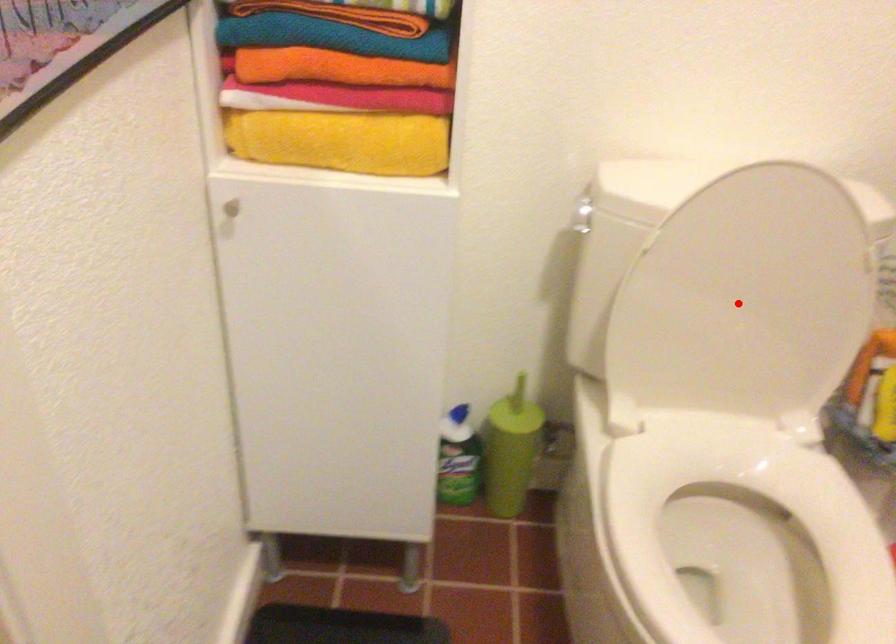
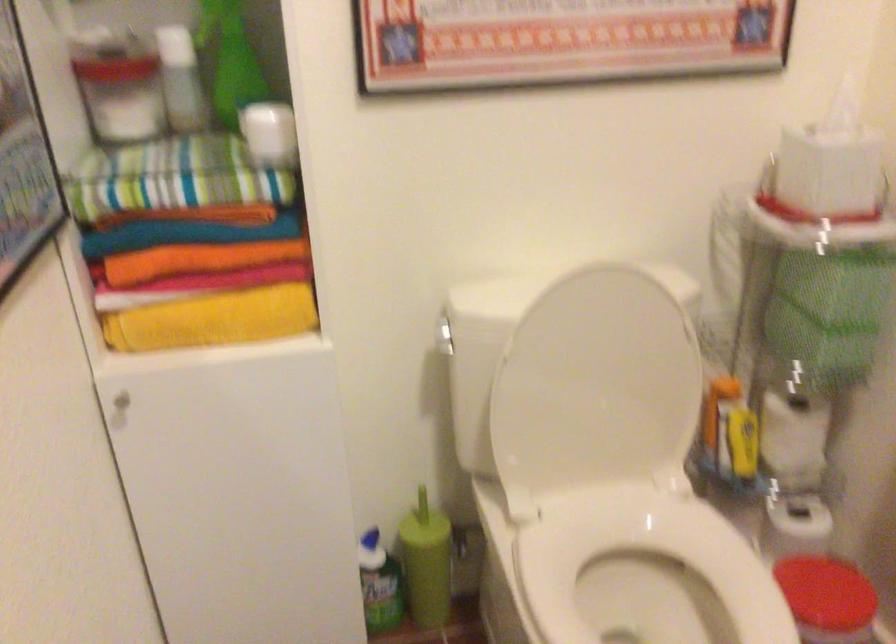
Locate, in the second image, the point that corresponds to the highlighted location in the first image.

(595, 388)